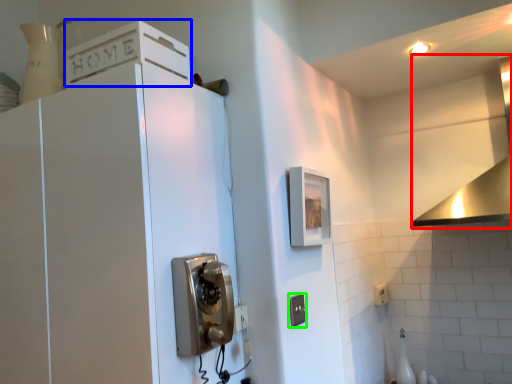
Question: Which object is positioned farthest from vent (highlighted by a red box)? Select from cabinetry (highlighted by a blue box) and electric outlet (highlighted by a green box).

Choices:
 (A) cabinetry
 (B) electric outlet

Answer: (A)